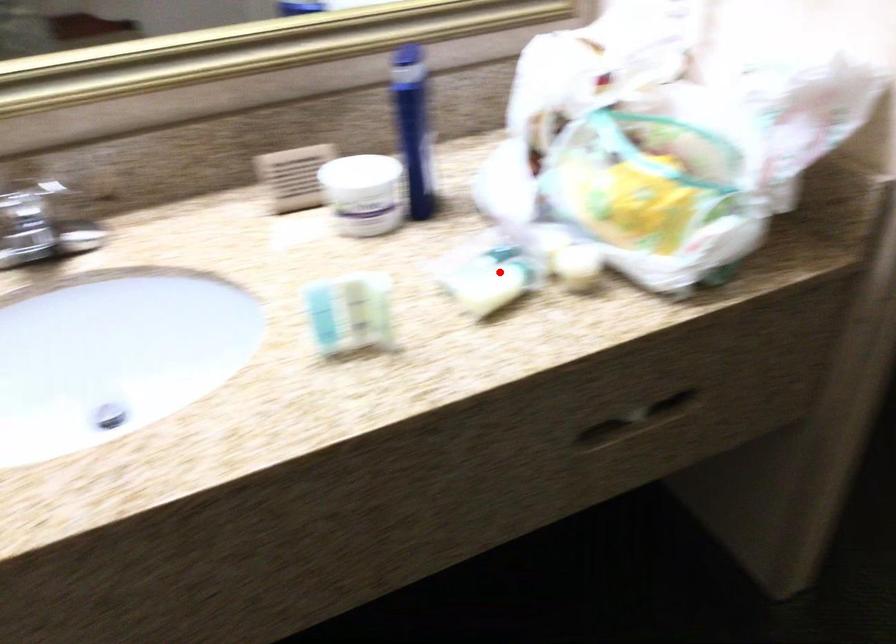
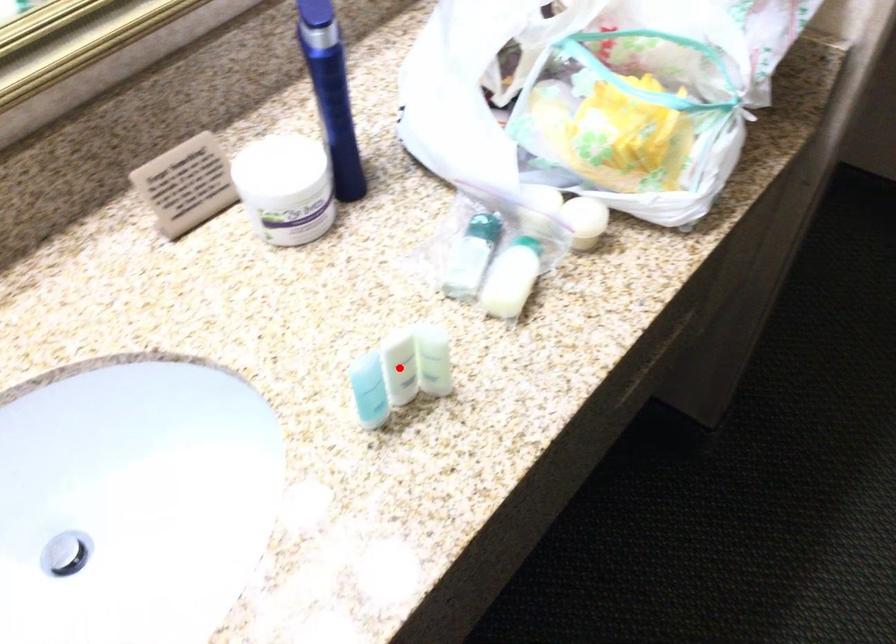
I am providing you with two images of the same scene from different viewpoints. A red point is marked on the first image and another point is marked on the second image. Are the points marked in image1 and image2 representing the same 3D position?

No